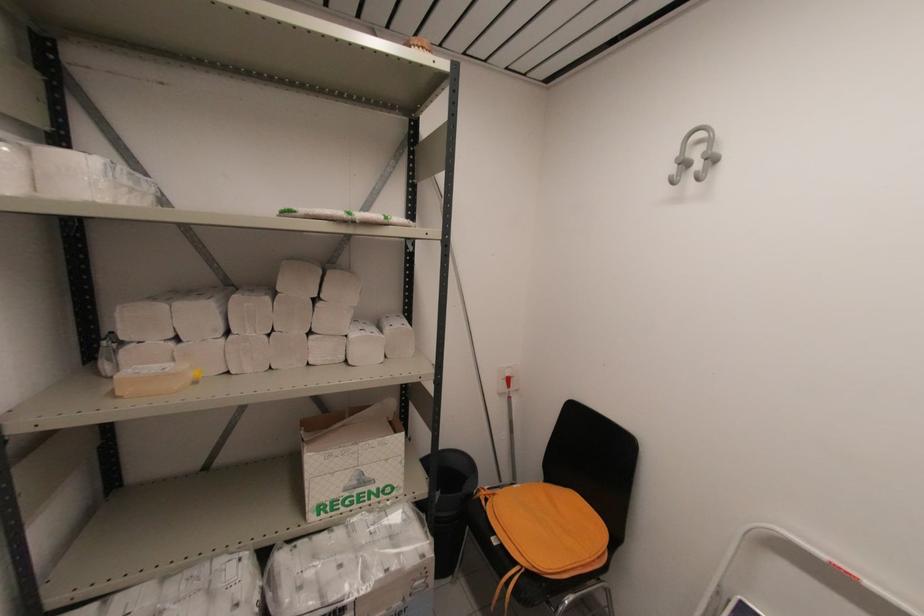
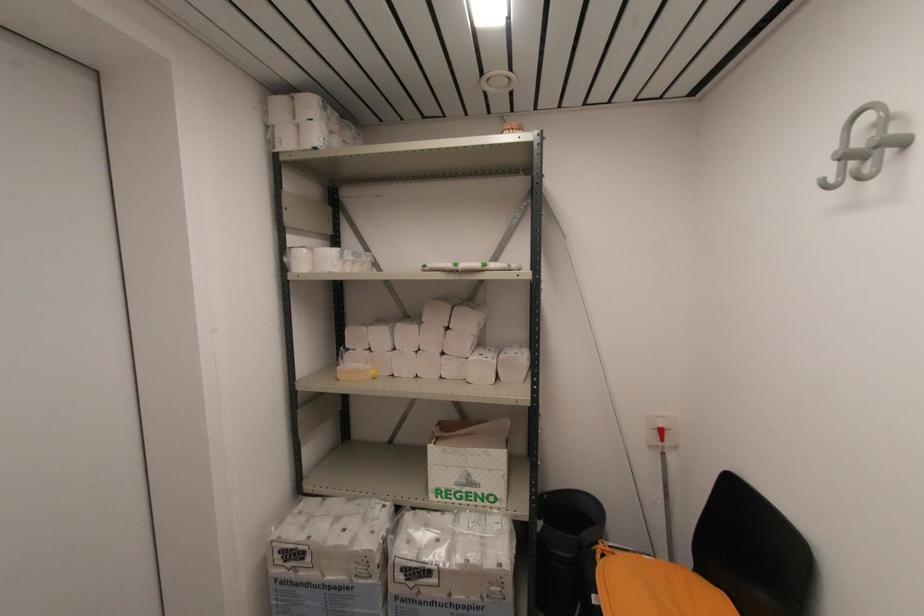
Locate, in the second image, the point that corresponds to the point at 356,483 in the first image.

(465, 480)